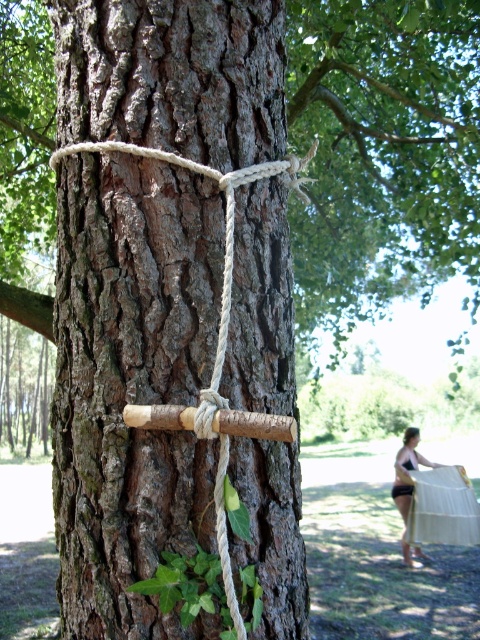
You are trying to secure a rope around a tree trunk and a wooden stick. Looking at the image, where is the rough bark tree trunk at center in relation to the brown rough wood at center?

The rough bark tree trunk at center is located below the brown rough wood at center, meaning the brown rough wood is positioned above the tree trunk.

You are trying to determine which object is thicker between the rough bark tree trunk at center and the brown rough wood at center. Based on the scene, which one is thicker?

The brown rough wood at center is thicker than the rough bark tree trunk at center.